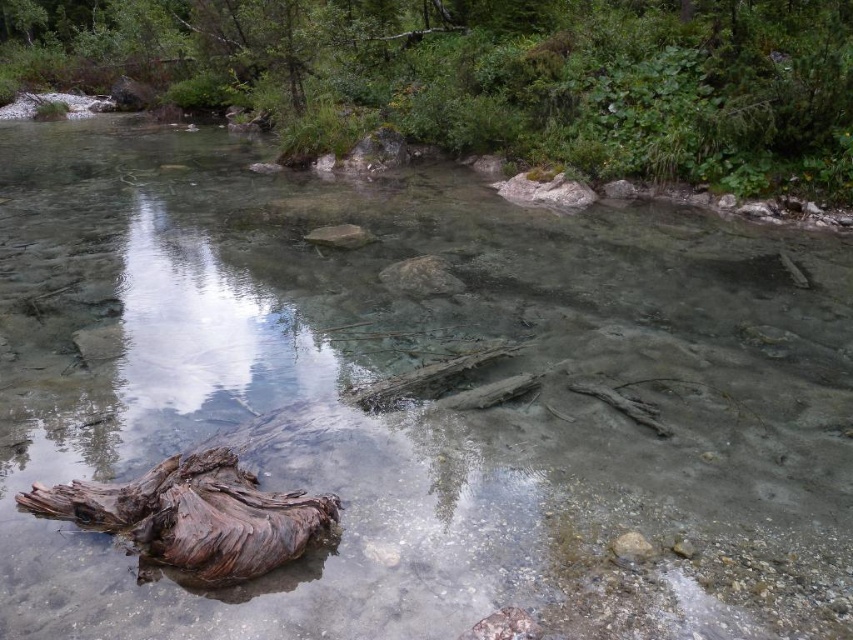
You are a hiker trying to cross the stream shown in the image. You see the brown wood log at upper center and the brown rough log at lower left. Which log is closer to your left side when facing upstream?

The brown wood log at upper center is positioned on the left side of brown rough log at lower left, so when facing upstream, the brown wood log at upper center would be closer to your left side.